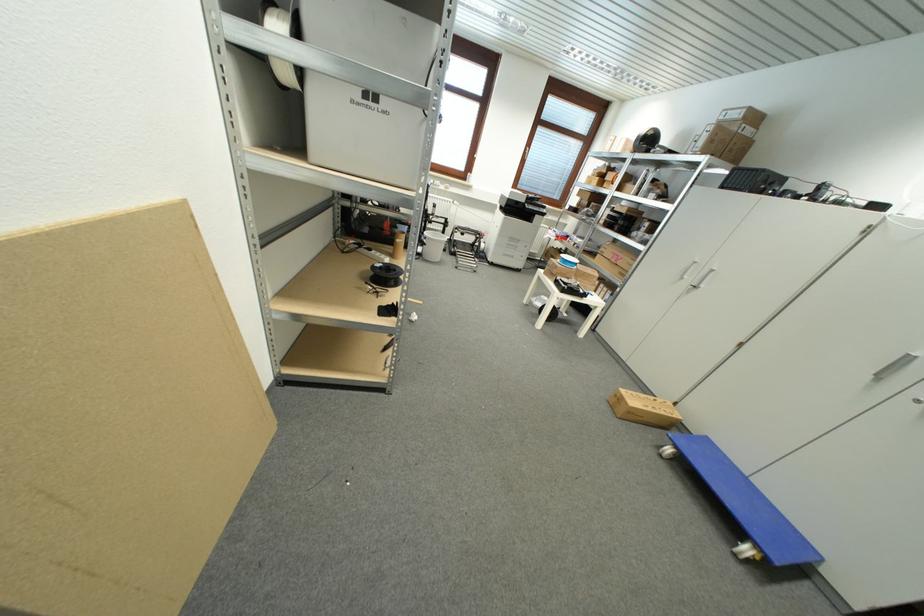
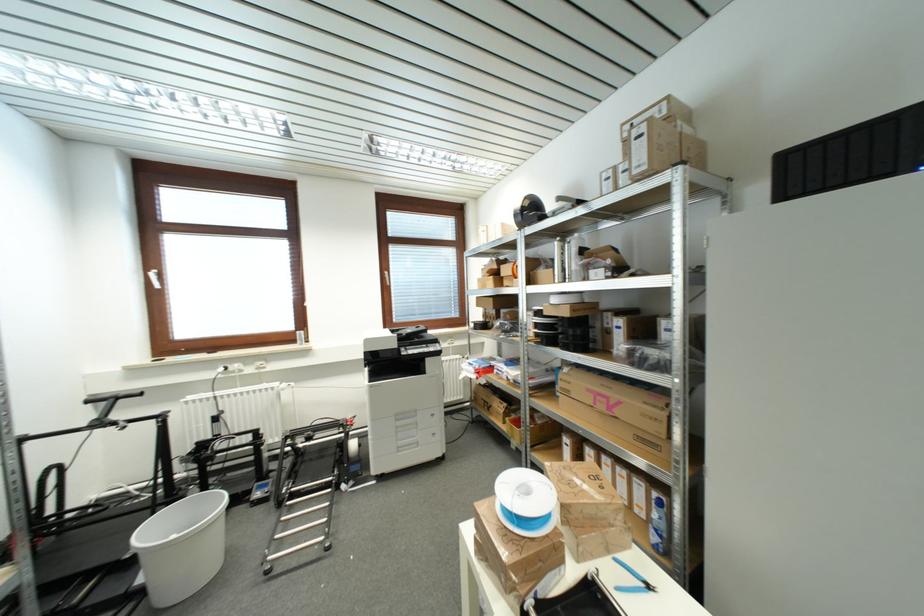
Locate, in the second image, the point that corresponds to pixel 649 134 in the first image.

(523, 207)